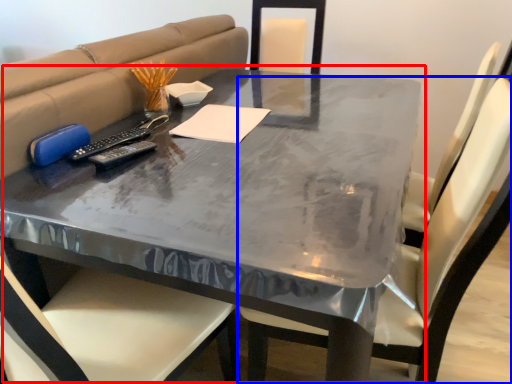
Question: Which object appears closest to the camera in this image, table (highlighted by a red box) or chair (highlighted by a blue box)?

Choices:
 (A) table
 (B) chair

Answer: (B)